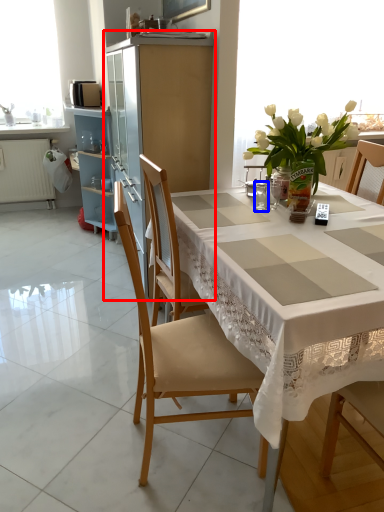
Question: Which object appears closest to the camera in this image, cabinetry (highlighted by a red box) or tableware (highlighted by a blue box)?

Choices:
 (A) cabinetry
 (B) tableware

Answer: (B)